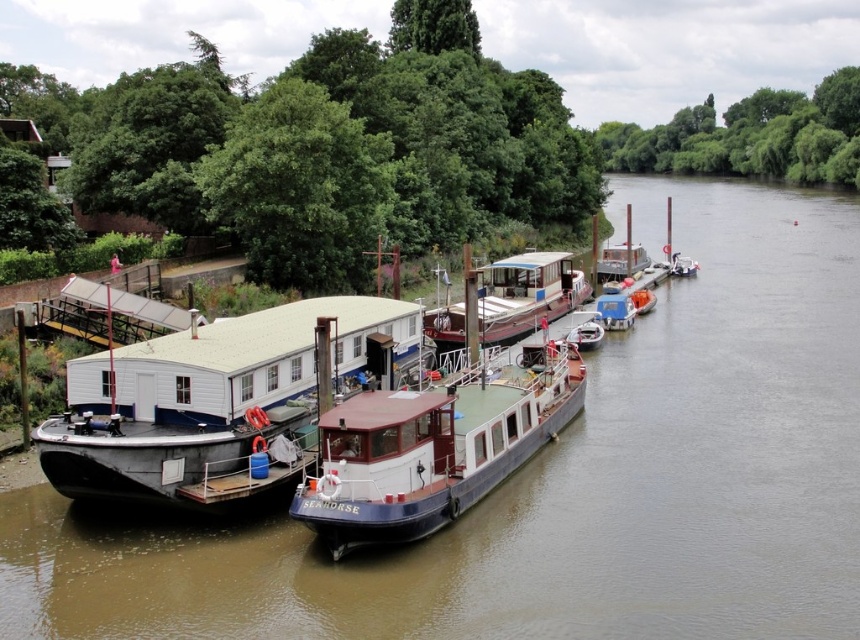
You are a visitor standing on the riverside path and want to board the metallic gray barge at center. Which direction should you walk from the dark blue polished wood boat at center to reach it?

You should walk to the right from the dark blue polished wood boat at center because it is positioned on the left side of the metallic gray barge at center.

You are standing on the dock and want to place a new boat at the exact location of the point marked at coordinates point (475, 445). The boat you want to place is 100 feet long. Will the boat fit entirely at that location without extending beyond the available space?

The point marked at coordinates point (475, 445) is 105.51 feet from the camera. Since the boat is 100 feet long, it will fit entirely at that location as the distance from the camera to the point provides sufficient space.

You are planning to dock your small fishing boat at the riverside. You see two boats at the center of the image, the white glossy houseboat at center and the white plastic boat at center. Which one takes up more space in the water? Please choose between the two.

The white plastic boat at center takes up more space in the water than the white glossy houseboat at center because the white glossy houseboat at center occupies less space than white plastic boat at center.